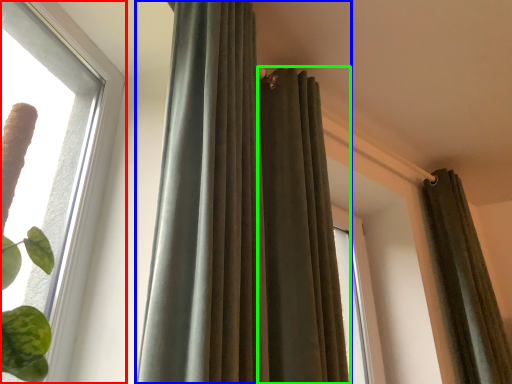
Question: Which object is positioned farthest from window (highlighted by a red box)? Select from curtain (highlighted by a blue box) and curtain (highlighted by a green box).

Choices:
 (A) curtain
 (B) curtain

Answer: (B)